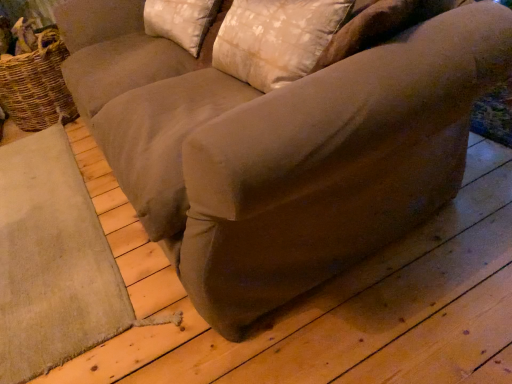
The width and height of the screenshot is (512, 384). Identify the location of beige fabric pillow at upper center, which ranks as the 2th pillow in front-to-back order. (180, 21).

Locate an element on the screen. satin beige pillow at upper center, arranged as the 2th pillow when viewed from the back is located at coordinates (275, 39).

This screenshot has height=384, width=512. What are the coordinates of `beige fabric pillow at upper center, which ranks as the 2th pillow in front-to-back order` in the screenshot? It's located at (180, 21).

Is point (265, 37) more distant than point (196, 26)?

No.

Which is more to the left, satin beige pillow at upper center, arranged as the 2th pillow when viewed from the back, or beige fabric pillow at upper center, which ranks as the 2th pillow in front-to-back order?

Positioned to the left is beige fabric pillow at upper center, which ranks as the 2th pillow in front-to-back order.

From the picture: Considering the sizes of satin beige pillow at upper center, the 1th pillow viewed from the front, and beige fabric pillow at upper center, which ranks as the 2th pillow in front-to-back order, in the image, is satin beige pillow at upper center, the 1th pillow viewed from the front, bigger or smaller than beige fabric pillow at upper center, which ranks as the 2th pillow in front-to-back order,?

In the image, satin beige pillow at upper center, the 1th pillow viewed from the front, appears to be smaller than beige fabric pillow at upper center, which ranks as the 2th pillow in front-to-back order.

Between beige fabric pillow at upper center, marked as the first pillow in a back-to-front arrangement, and woven brown basket at left, which one has larger size?

woven brown basket at left is bigger.

Is beige fabric pillow at upper center, which ranks as the 2th pillow in front-to-back order, turned away from woven brown basket at left?

beige fabric pillow at upper center, which ranks as the 2th pillow in front-to-back order, is not turned away from woven brown basket at left.

Is beige fabric pillow at upper center, marked as the first pillow in a back-to-front arrangement, not near woven brown basket at left?

Actually, beige fabric pillow at upper center, marked as the first pillow in a back-to-front arrangement, and woven brown basket at left are a little close together.

I want to click on the 1st pillow counting from the right of the woven brown basket at left, so click(180, 21).

You are a GUI agent. You are given a task and a screenshot of the screen. Output one action in this format:
    pyautogui.click(x=<x>, y=<y>)
    Task: Click on the basket below the beige fabric pillow at upper center, which ranks as the 2th pillow in front-to-back order (from a real-world perspective)
    This screenshot has width=512, height=384.
    Given the screenshot: What is the action you would take?
    pyautogui.click(x=37, y=85)

From a real-world perspective, who is located lower, woven brown basket at left or beige fabric pillow at upper center, which ranks as the 2th pillow in front-to-back order?

From a 3D spatial view, woven brown basket at left is below.

Is point (70, 97) closer to viewer compared to point (179, 19)?

That is False.

From the image's perspective, between woven brown basket at left and beige fabric pillow at upper center, which ranks as the 2th pillow in front-to-back order, who is located below?

From the image's view, woven brown basket at left is below.

Is satin beige pillow at upper center, the 1th pillow viewed from the front, far away from woven brown basket at left?

Indeed, satin beige pillow at upper center, the 1th pillow viewed from the front, is not near woven brown basket at left.

Considering the sizes of satin beige pillow at upper center, arranged as the 2th pillow when viewed from the back, and woven brown basket at left in the image, is satin beige pillow at upper center, arranged as the 2th pillow when viewed from the back, taller or shorter than woven brown basket at left?

satin beige pillow at upper center, arranged as the 2th pillow when viewed from the back, is shorter than woven brown basket at left.

Is satin beige pillow at upper center, the 1th pillow viewed from the front, inside or outside of woven brown basket at left?

satin beige pillow at upper center, the 1th pillow viewed from the front, is located beyond the bounds of woven brown basket at left.

Does woven brown basket at left have a larger size compared to satin beige pillow at upper center, arranged as the 2th pillow when viewed from the back?

Yes, woven brown basket at left is bigger than satin beige pillow at upper center, arranged as the 2th pillow when viewed from the back.

Considering the sizes of objects woven brown basket at left and satin beige pillow at upper center, arranged as the 2th pillow when viewed from the back, in the image provided, who is taller, woven brown basket at left or satin beige pillow at upper center, arranged as the 2th pillow when viewed from the back,?

woven brown basket at left.

Could you tell me if woven brown basket at left is facing satin beige pillow at upper center, the 1th pillow viewed from the front?

Yes, woven brown basket at left is turned towards satin beige pillow at upper center, the 1th pillow viewed from the front.

Can you tell me how much woven brown basket at left and satin beige pillow at upper center, the 1th pillow viewed from the front, differ in facing direction?

woven brown basket at left and satin beige pillow at upper center, the 1th pillow viewed from the front, are facing 88.9 degrees away from each other.

In the scene shown: How much distance is there between beige fabric pillow at upper center, which ranks as the 2th pillow in front-to-back order, and satin beige pillow at upper center, arranged as the 2th pillow when viewed from the back?

The distance of beige fabric pillow at upper center, which ranks as the 2th pillow in front-to-back order, from satin beige pillow at upper center, arranged as the 2th pillow when viewed from the back, is 18.36 inches.

Between beige fabric pillow at upper center, marked as the first pillow in a back-to-front arrangement, and satin beige pillow at upper center, the 1th pillow viewed from the front, which one is positioned in front?

Answer: satin beige pillow at upper center, the 1th pillow viewed from the front, is closer to the camera.

The height and width of the screenshot is (384, 512). Identify the location of pillow below the satin beige pillow at upper center, the 1th pillow viewed from the front (from a real-world perspective). (180, 21).

Choose the correct answer: Is beige fabric pillow at upper center, which ranks as the 2th pillow in front-to-back order, inside satin beige pillow at upper center, arranged as the 2th pillow when viewed from the back, or outside it?

beige fabric pillow at upper center, which ranks as the 2th pillow in front-to-back order, exists outside the volume of satin beige pillow at upper center, arranged as the 2th pillow when viewed from the back.

This screenshot has width=512, height=384. In order to click on pillow behind the satin beige pillow at upper center, the 1th pillow viewed from the front in this screenshot , I will do `click(180, 21)`.

Identify the location of pillow that is above the woven brown basket at left (from the image's perspective). (180, 21).

Which object lies nearer to the anchor point satin beige pillow at upper center, the 1th pillow viewed from the front, beige fabric pillow at upper center, which ranks as the 2th pillow in front-to-back order, or woven brown basket at left?

beige fabric pillow at upper center, which ranks as the 2th pillow in front-to-back order, lies closer to satin beige pillow at upper center, the 1th pillow viewed from the front, than the other object.

When comparing their distances from beige fabric pillow at upper center, which ranks as the 2th pillow in front-to-back order, does satin beige pillow at upper center, the 1th pillow viewed from the front, or woven brown basket at left seem further?

woven brown basket at left is further to beige fabric pillow at upper center, which ranks as the 2th pillow in front-to-back order.

Looking at the image, which one is located further to woven brown basket at left, satin beige pillow at upper center, arranged as the 2th pillow when viewed from the back, or beige fabric pillow at upper center, which ranks as the 2th pillow in front-to-back order?

satin beige pillow at upper center, arranged as the 2th pillow when viewed from the back, is positioned further to the anchor woven brown basket at left.

In the scene shown: Looking at the image, which one is located further to beige fabric pillow at upper center, marked as the first pillow in a back-to-front arrangement, woven brown basket at left or satin beige pillow at upper center, the 1th pillow viewed from the front?

woven brown basket at left.

Considering their positions, is woven brown basket at left positioned closer to satin beige pillow at upper center, the 1th pillow viewed from the front, than beige fabric pillow at upper center, marked as the first pillow in a back-to-front arrangement?

beige fabric pillow at upper center, marked as the first pillow in a back-to-front arrangement, is closer to satin beige pillow at upper center, the 1th pillow viewed from the front.

Estimate the real-world distances between objects in this image. Which object is closer to woven brown basket at left, beige fabric pillow at upper center, marked as the first pillow in a back-to-front arrangement, or satin beige pillow at upper center, the 1th pillow viewed from the front?

Based on the image, beige fabric pillow at upper center, marked as the first pillow in a back-to-front arrangement, appears to be nearer to woven brown basket at left.

This screenshot has width=512, height=384. Identify the location of pillow between woven brown basket at left and satin beige pillow at upper center, arranged as the 2th pillow when viewed from the back. (180, 21).